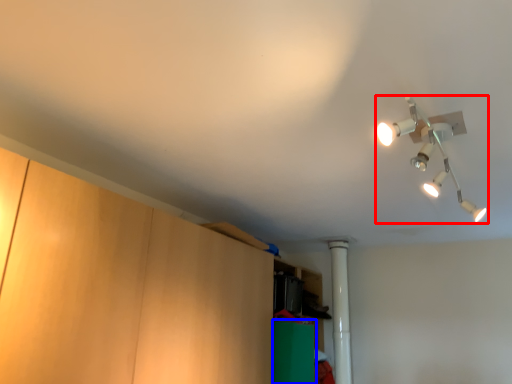
Question: Among these objects, which one is nearest to the camera, lamp (highlighted by a red box) or cabinetry (highlighted by a blue box)?

Choices:
 (A) lamp
 (B) cabinetry

Answer: (A)